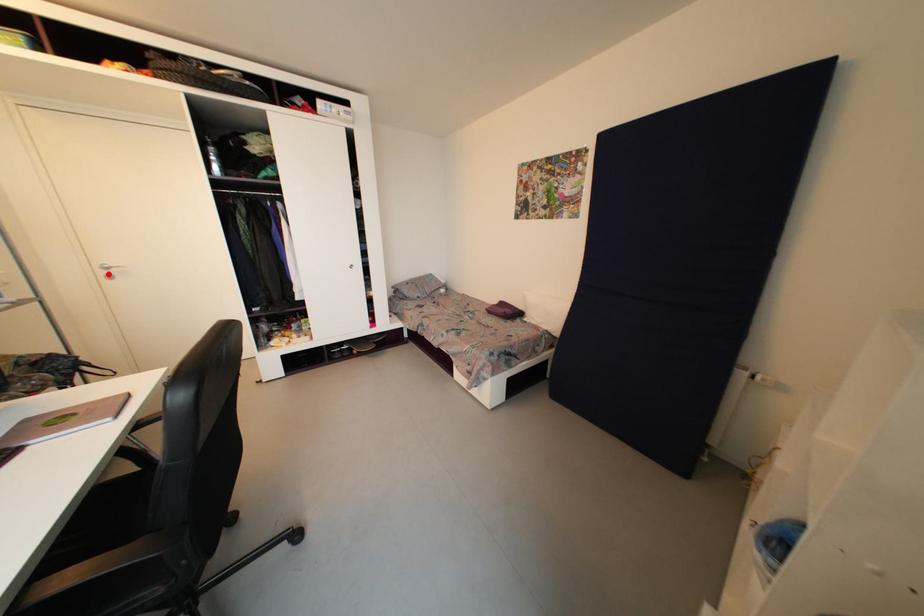
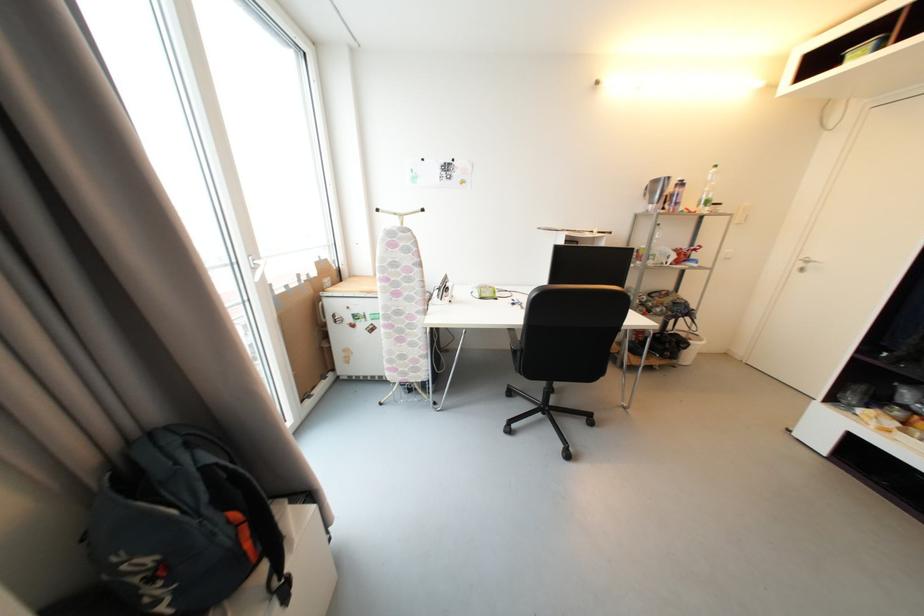
In the second image, find the point that corresponds to the highlighted location in the first image.

(806, 267)